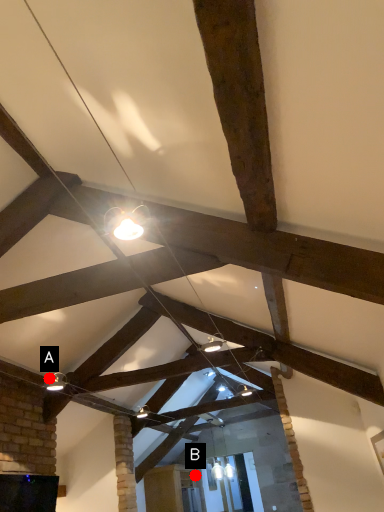
Question: Two points are circled on the image, labeled by A and B beside each circle. Which point is further to the camera?

Choices:
 (A) A is further
 (B) B is further

Answer: (B)